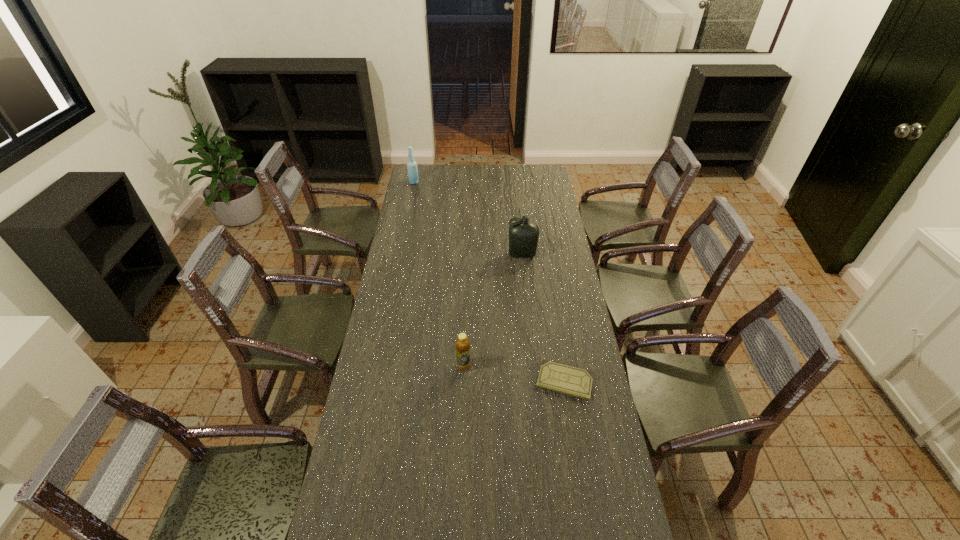
Select which object is the third closest to the second nearest bottle. Please provide its 2D coordinates. Your answer should be formatted as a tuple, i.e. [(x, y)], where the tuple contains the x and y coordinates of a point satisfying the conditions above.

[(411, 164)]

This screenshot has height=540, width=960. Identify the location of the third closest object to the shortest bottle. (411, 164).

The height and width of the screenshot is (540, 960). Identify the location of bottle that stands as the closest to the rightmost bottle. (462, 344).

You are a GUI agent. You are given a task and a screenshot of the screen. Output one action in this format:
    pyautogui.click(x=<x>, y=<y>)
    Task: Click on the bottle that stands as the second closest to the shortest object
    The width and height of the screenshot is (960, 540).
    Given the screenshot: What is the action you would take?
    pyautogui.click(x=523, y=235)

Locate an element on the screen. The height and width of the screenshot is (540, 960). vacant region that satisfies the following two spatial constraints: 1. on the front side of the nearest bottle; 2. on the right side of the farthest bottle is located at coordinates (375, 366).

Find the location of a particular element. Image resolution: width=960 pixels, height=540 pixels. blank space that satisfies the following two spatial constraints: 1. on the front side of the checkbook; 2. on the left side of the rightmost bottle is located at coordinates (536, 381).